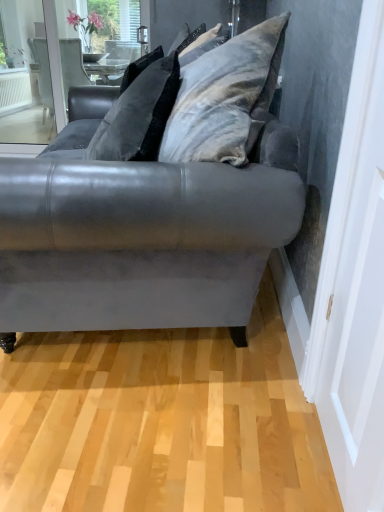
Question: Can you confirm if velvet gray pillow at upper center is taller than velvet gray couch at center?

Choices:
 (A) yes
 (B) no

Answer: (B)

Question: Considering the relative sizes of velvet gray pillow at upper center and velvet gray couch at center in the image provided, is velvet gray pillow at upper center thinner than velvet gray couch at center?

Choices:
 (A) yes
 (B) no

Answer: (A)

Question: Is velvet gray pillow at upper center oriented away from velvet gray couch at center?

Choices:
 (A) yes
 (B) no

Answer: (B)

Question: Can you confirm if velvet gray pillow at upper center is wider than velvet gray couch at center?

Choices:
 (A) no
 (B) yes

Answer: (A)

Question: Could velvet gray couch at center be considered to be inside velvet gray pillow at upper center?

Choices:
 (A) yes
 (B) no

Answer: (B)

Question: Does velvet gray pillow at upper center have a larger size compared to velvet gray couch at center?

Choices:
 (A) yes
 (B) no

Answer: (B)

Question: Does velvet gray couch at center have a lesser height compared to velvet gray pillow at upper center?

Choices:
 (A) no
 (B) yes

Answer: (A)

Question: From the image's perspective, is velvet gray couch at center located above velvet gray pillow at upper center?

Choices:
 (A) yes
 (B) no

Answer: (B)

Question: Is velvet gray pillow at upper center located within velvet gray couch at center?

Choices:
 (A) yes
 (B) no

Answer: (A)

Question: From a real-world perspective, is velvet gray couch at center physically above velvet gray pillow at upper center?

Choices:
 (A) no
 (B) yes

Answer: (A)

Question: From a real-world perspective, does velvet gray couch at center sit lower than velvet gray pillow at upper center?

Choices:
 (A) yes
 (B) no

Answer: (A)

Question: Can you see velvet gray couch at center touching velvet gray pillow at upper center?

Choices:
 (A) yes
 (B) no

Answer: (B)

Question: Is matte gray screen door at right positioned before velvet gray couch at center?

Choices:
 (A) yes
 (B) no

Answer: (A)